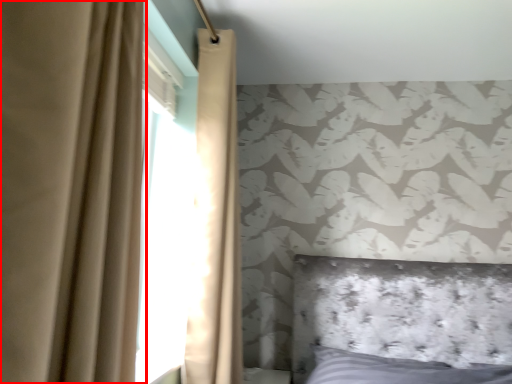
Question: From the image, what is the correct spatial relationship of curtain (annotated by the red box) in relation to curtain?

Choices:
 (A) left
 (B) right

Answer: (A)